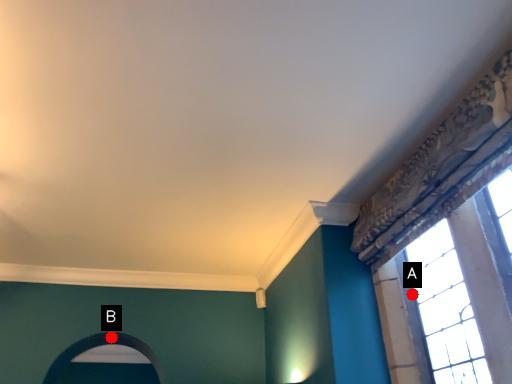
Question: Two points are circled on the image, labeled by A and B beside each circle. Which of the following is the farthest from the observer?

Choices:
 (A) A is further
 (B) B is further

Answer: (B)